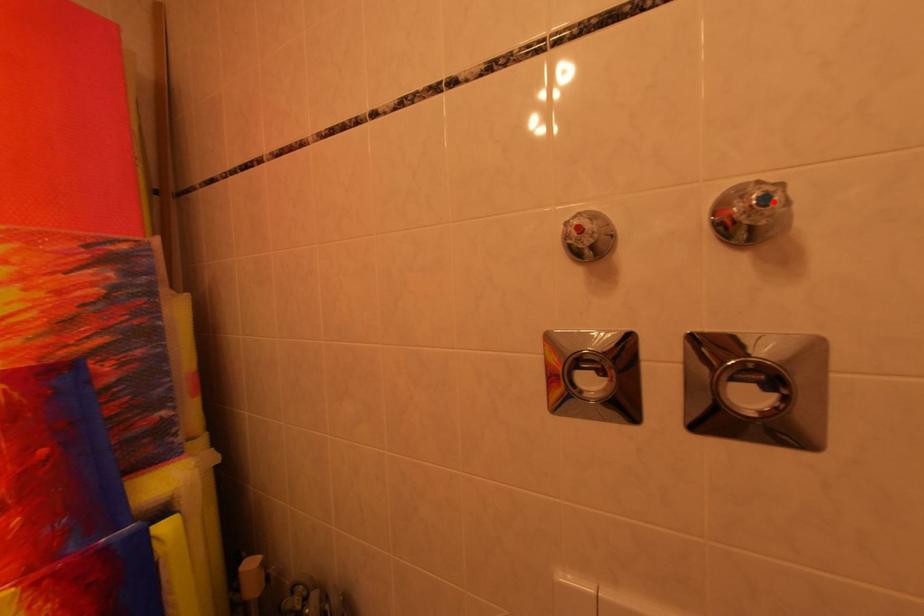
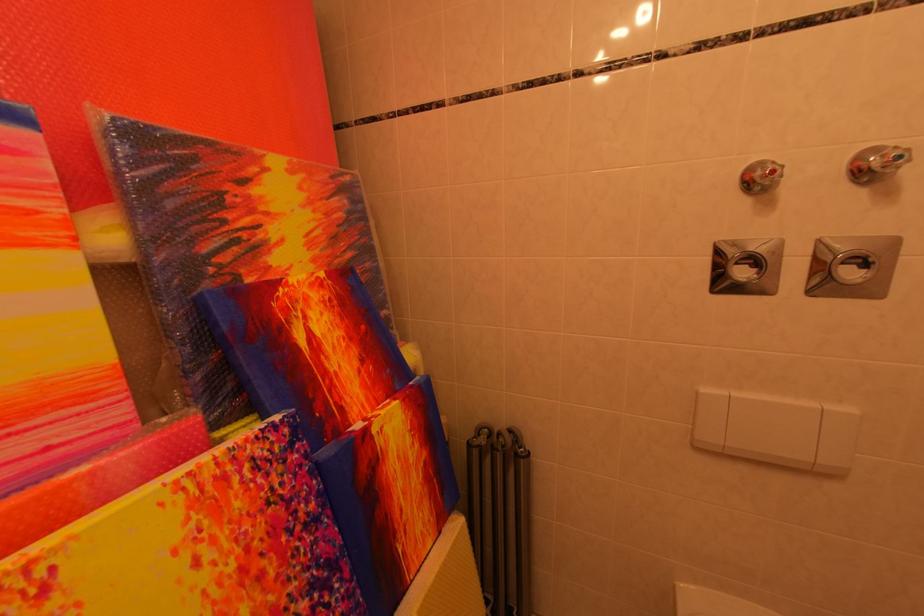
Question: I am providing you with two images of the same scene from different viewpoints. In image1, a red point is highlighted. Considering the same 3D point in image2, which of the following is correct?

Choices:
 (A) It is closer
 (B) It is farther

Answer: (B)